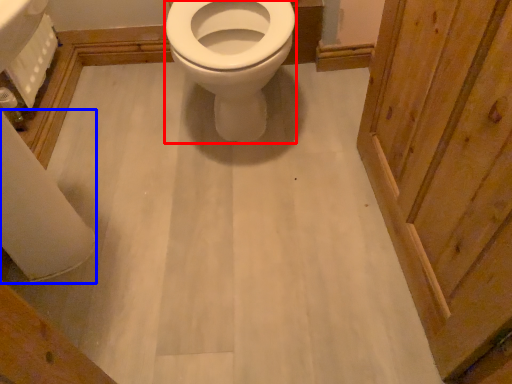
Question: Which of the following is the closest to the observer, bidet (highlighted by a red box) or toilet paper (highlighted by a blue box)?

Choices:
 (A) bidet
 (B) toilet paper

Answer: (A)